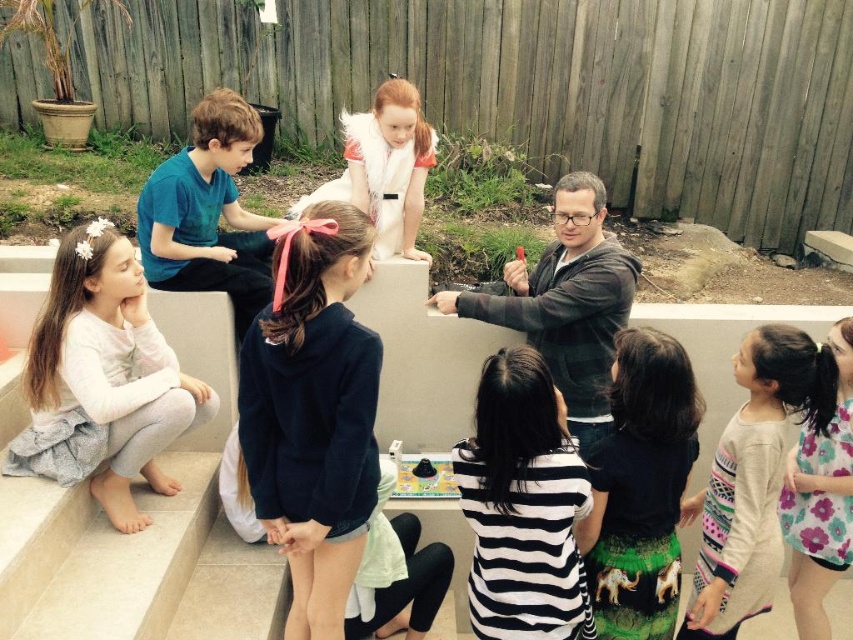
You are standing in the backyard and want to place a small flag at the point closer to you between the two points, point (x=496, y=356) and point (x=621, y=621). Which point should you choose?

You should choose point (x=496, y=356) because it is closer to you than point (x=621, y=621).